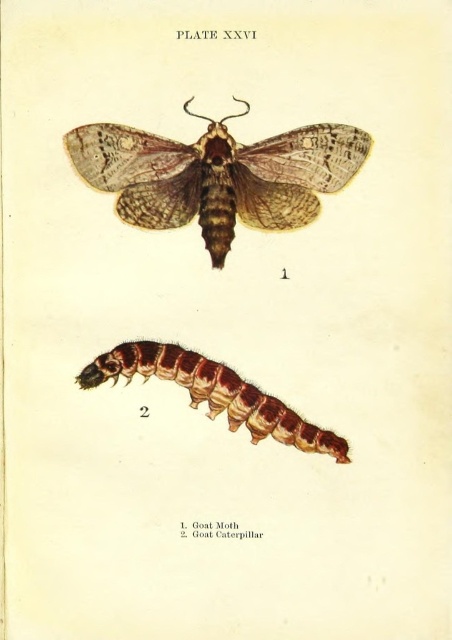
The image size is (452, 640). In order to click on brown textured moth at upper center in this screenshot , I will do `click(217, 176)`.

Can you confirm if brown textured moth at upper center is taller than brown fuzzy caterpillar at lower center?

Yes, brown textured moth at upper center is taller than brown fuzzy caterpillar at lower center.

The width and height of the screenshot is (452, 640). I want to click on brown textured moth at upper center, so click(217, 176).